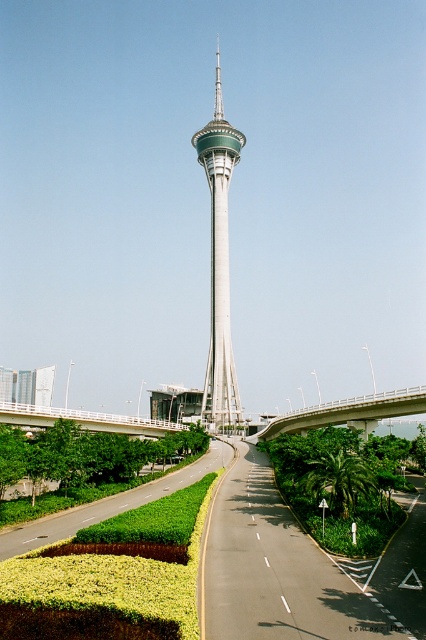
Question: Is white concrete bridge at center closer to the viewer compared to white concrete bridge at lower center?

Choices:
 (A) yes
 (B) no

Answer: (A)

Question: Which object appears farthest from the camera in this image?

Choices:
 (A) white concrete bridge at lower center
 (B) green metallic tower at center
 (C) white concrete bridge at center

Answer: (B)

Question: Is green metallic tower at center wider than white concrete bridge at lower center?

Choices:
 (A) no
 (B) yes

Answer: (A)

Question: Can you confirm if green metallic tower at center is smaller than white concrete bridge at lower center?

Choices:
 (A) yes
 (B) no

Answer: (B)

Question: Among these points, which one is farthest from the camera?

Choices:
 (A) (120, 428)
 (B) (405, 392)

Answer: (A)

Question: Which point is farther to the camera?

Choices:
 (A) (158, 426)
 (B) (204, 132)
 (C) (302, 413)

Answer: (B)